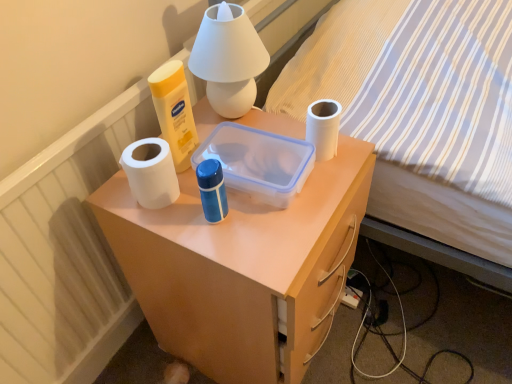
Question: From the image's perspective, is white matte desk at center under white matte paper towel at left?

Choices:
 (A) no
 (B) yes

Answer: (B)

Question: Can you confirm if white matte desk at center is taller than white matte paper towel at left?

Choices:
 (A) yes
 (B) no

Answer: (A)

Question: Is white matte desk at center oriented towards white matte paper towel at left?

Choices:
 (A) yes
 (B) no

Answer: (B)

Question: Is white matte desk at center thinner than white matte paper towel at left?

Choices:
 (A) yes
 (B) no

Answer: (B)

Question: Is white matte desk at center wider than white matte paper towel at left?

Choices:
 (A) yes
 (B) no

Answer: (A)

Question: Is white matte desk at center located outside white matte paper towel at left?

Choices:
 (A) yes
 (B) no

Answer: (A)

Question: Would you consider white matte paper towel at left to be distant from striped fabric bed at upper right?

Choices:
 (A) no
 (B) yes

Answer: (A)

Question: From the image's perspective, is white matte paper towel at left under striped fabric bed at upper right?

Choices:
 (A) yes
 (B) no

Answer: (A)

Question: Is white matte paper towel at left at the left side of striped fabric bed at upper right?

Choices:
 (A) yes
 (B) no

Answer: (A)

Question: Can you confirm if white matte paper towel at left is bigger than striped fabric bed at upper right?

Choices:
 (A) yes
 (B) no

Answer: (B)

Question: Is white matte paper towel at left oriented towards striped fabric bed at upper right?

Choices:
 (A) no
 (B) yes

Answer: (A)

Question: Is white matte paper towel at left facing away from striped fabric bed at upper right?

Choices:
 (A) no
 (B) yes

Answer: (A)

Question: Is white matte toilet paper at right positioned in front of white matte desk at center?

Choices:
 (A) yes
 (B) no

Answer: (B)